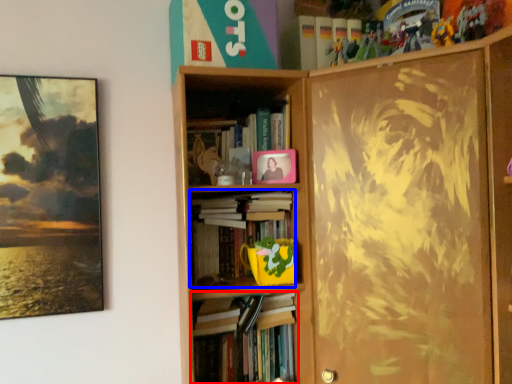
Question: Which object appears closest to the camera in this image, book (highlighted by a red box) or book (highlighted by a blue box)?

Choices:
 (A) book
 (B) book

Answer: (A)